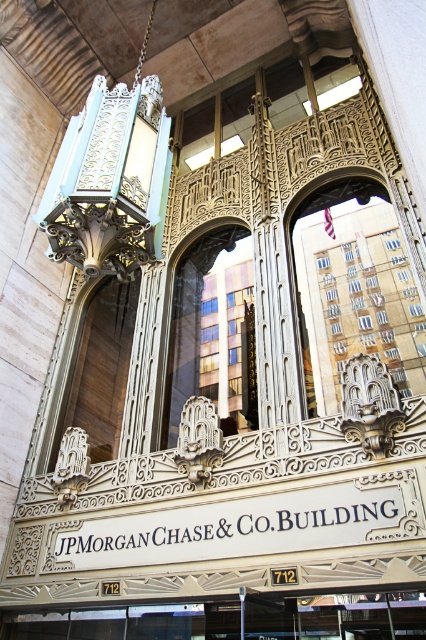
Question: Which object appears farthest from the camera in this image?

Choices:
 (A) gold ornate arch at center
 (B) wooden at center
 (C) gold ornate frame at center

Answer: (B)

Question: Does wooden at center appear over gold ornate frame at center?

Choices:
 (A) yes
 (B) no

Answer: (B)

Question: Is gold ornate arch at center thinner than gold ornate frame at center?

Choices:
 (A) yes
 (B) no

Answer: (B)

Question: Which point is closer to the camera taking this photo?

Choices:
 (A) (103, 349)
 (B) (370, 288)

Answer: (B)

Question: Does gold ornate arch at center have a greater width compared to gold ornate frame at center?

Choices:
 (A) no
 (B) yes

Answer: (B)

Question: Among these points, which one is nearest to the camera?

Choices:
 (A) (353, 346)
 (B) (120, 378)

Answer: (A)